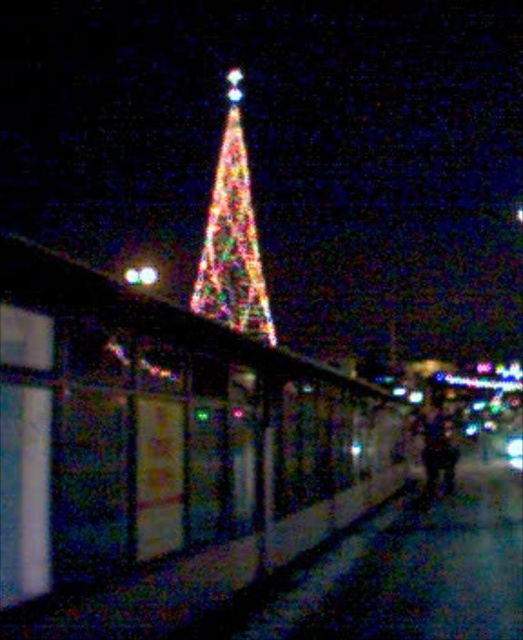
You are a delivery person who needs to place a large package between the iridescent glass christmas tree at center and the multicolored fabric at center. Based on their sizes, which object should you position the package closer to?

The iridescent glass christmas tree at center is bigger than the multicolored fabric at center, so you should position the package closer to the iridescent glass christmas tree at center to ensure there is enough space.

You are a delivery drone that needs to fly from the iridescent glass christmas tree at center to the multicolored fabric at center. Given that your maximum flight distance is 60 meters, can you make the trip without recharging?

The distance between the iridescent glass christmas tree at center and the multicolored fabric at center is 57.42 meters, which is under the drone s 60 meter limit. Yes, the drone can complete the trip without needing to recharge.